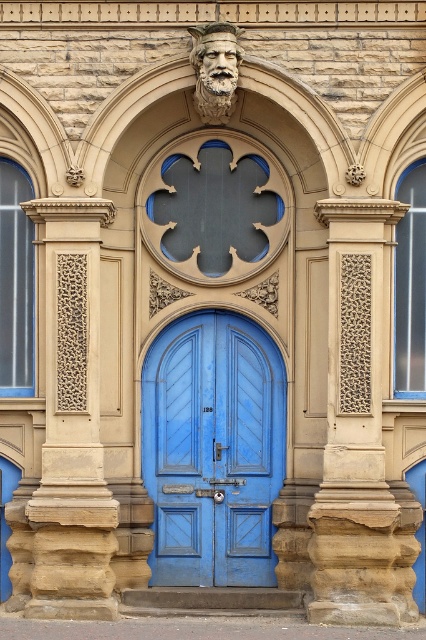
Question: Which point is closer to the camera taking this photo?

Choices:
 (A) (333, 339)
 (B) (215, 518)

Answer: (A)

Question: Considering the relative positions of beige textured stone pillar at center and sandstone textured column at left in the image provided, where is beige textured stone pillar at center located with respect to sandstone textured column at left?

Choices:
 (A) above
 (B) below

Answer: (A)

Question: Among these points, which one is farthest from the camera?

Choices:
 (A) [80, 552]
 (B) [379, 227]

Answer: (B)

Question: Estimate the real-world distances between objects in this image. Which object is closer to the sandstone textured column at left?

Choices:
 (A) matte blue door at center
 (B) beige textured stone pillar at center

Answer: (A)

Question: Does matte blue door at center lie in front of beige textured stone pillar at center?

Choices:
 (A) yes
 (B) no

Answer: (B)

Question: Can you confirm if matte blue door at center is positioned to the right of beige textured stone pillar at center?

Choices:
 (A) no
 (B) yes

Answer: (A)